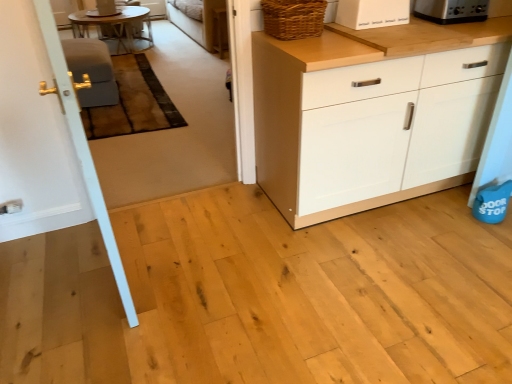
At what (x,y) coordinates should I click in order to perform the action: click on vacant space positioned to the left of white painted wood door at left. Please return your answer as a coordinate pair (x, y). The image size is (512, 384). Looking at the image, I should click on (55, 268).